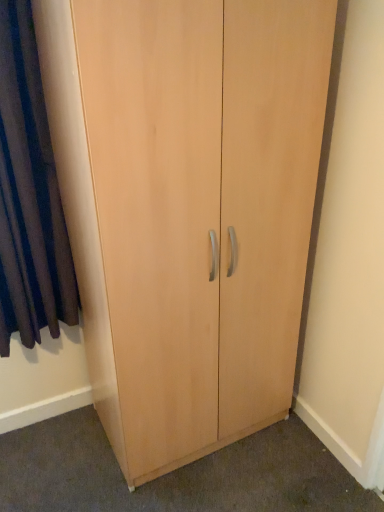
At what (x,y) coordinates should I click in order to perform the action: click on dark blue fabric at left. Please return your answer as a coordinate pair (x, y). Looking at the image, I should click on (29, 195).

Image resolution: width=384 pixels, height=512 pixels. What do you see at coordinates (29, 195) in the screenshot? I see `dark blue fabric at left` at bounding box center [29, 195].

You are a GUI agent. You are given a task and a screenshot of the screen. Output one action in this format:
    pyautogui.click(x=<x>, y=<y>)
    Task: Click on the dark blue fabric at left
    This screenshot has width=384, height=512.
    Given the screenshot: What is the action you would take?
    pyautogui.click(x=29, y=195)